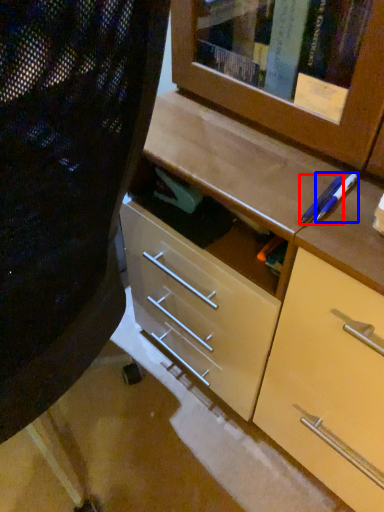
Question: Which object appears closest to the camera in this image, pencil (highlighted by a red box) or pencil (highlighted by a blue box)?

Choices:
 (A) pencil
 (B) pencil

Answer: (A)